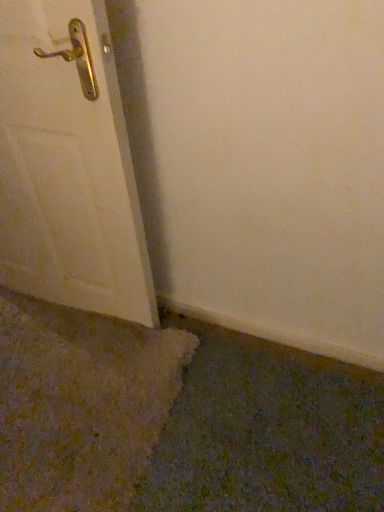
Question: Should I look upward or downward to see white matte door at left?

Choices:
 (A) up
 (B) down

Answer: (A)